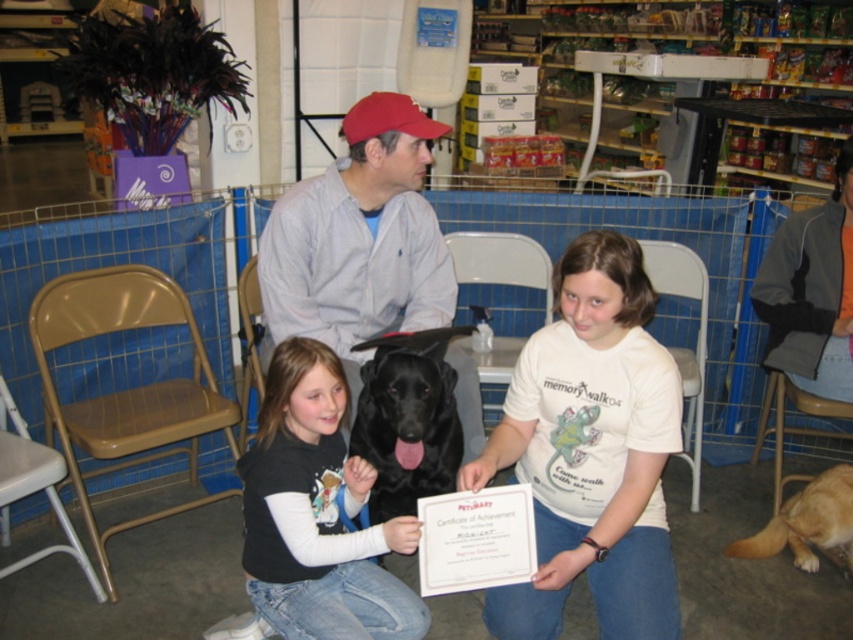
You are a photographer standing 1.5 meters away from the camera. You want to take a photo of the black matte shirt at center. Can you reach it without moving the camera?

The black matte shirt at center is 1.73 meters away from the camera. Since you are standing 1.5 meters away from the camera, you are closer to the camera than the shirt. Therefore, you can reach the black matte shirt at center by extending your arm or moving slightly forward without needing to move the camera itself.

Based on the photo, in the pet store scene, there is an orange fleece jacket at upper right and a black matte dog at center. From the perspective of the dog, which object is located to its right?

The orange fleece jacket at upper right is to the right of the black matte dog at center, so from the dog s perspective, the orange fleece jacket at upper right is located to its right.